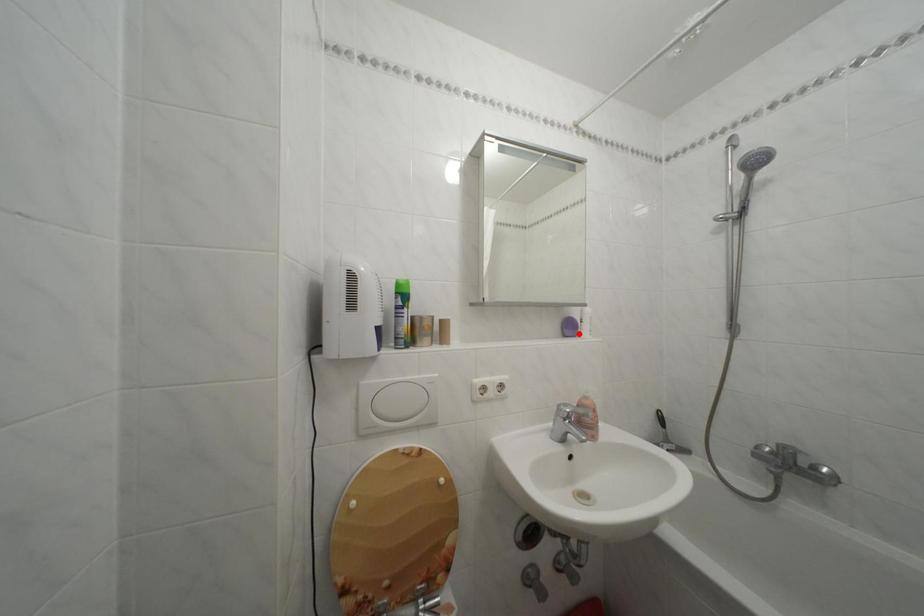
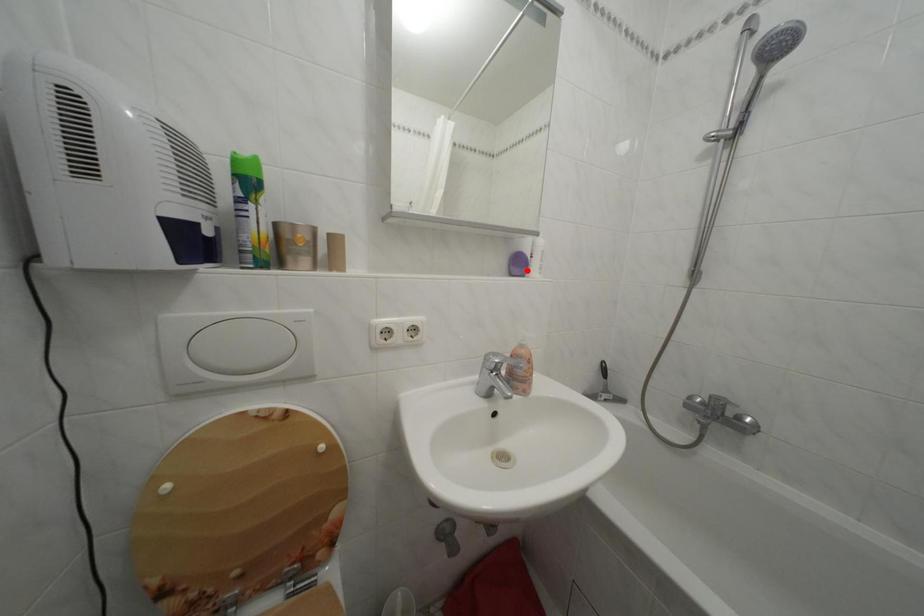
I am providing you with two images of the same scene from different viewpoints. A red point is marked on the first image and another point is marked on the second image. Does the point marked in image1 correspond to the same location as the one in image2?

Yes